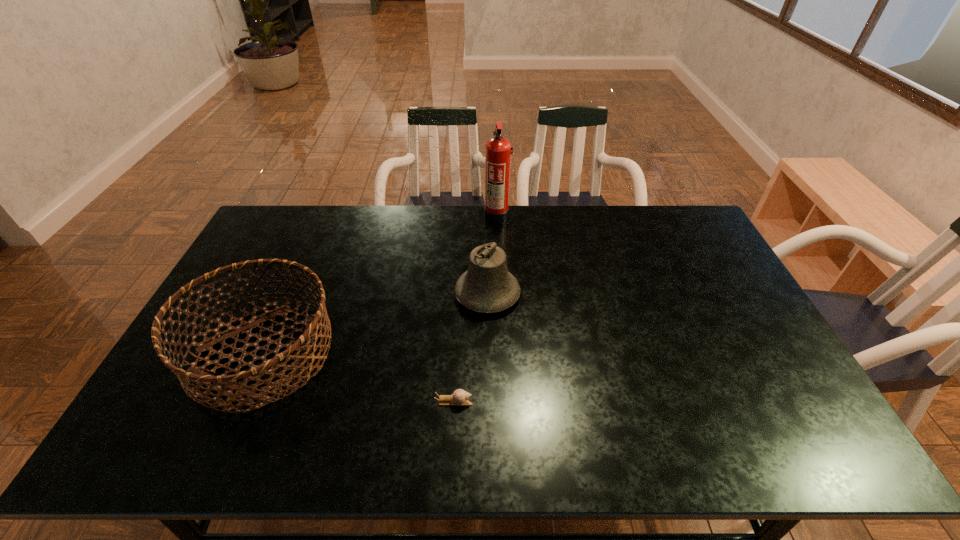
I want to click on fire extinguisher, so click(498, 152).

Image resolution: width=960 pixels, height=540 pixels. What are the coordinates of `the tallest object` in the screenshot? It's located at (498, 152).

You are a GUI agent. You are given a task and a screenshot of the screen. Output one action in this format:
    pyautogui.click(x=<x>, y=<y>)
    Task: Click on the bell
    The height and width of the screenshot is (540, 960).
    Given the screenshot: What is the action you would take?
    pyautogui.click(x=487, y=286)

The height and width of the screenshot is (540, 960). Find the location of `basket`. basket is located at coordinates (303, 344).

This screenshot has height=540, width=960. I want to click on escargot, so click(x=459, y=397).

Where is `vacant space positioned 0.130m with the nozzle pointing from the back of the farthest object`? The height and width of the screenshot is (540, 960). vacant space positioned 0.130m with the nozzle pointing from the back of the farthest object is located at coordinates (450, 215).

Find the location of `vacant space located 0.170m with the nozzle pointing from the back of the farthest object`. vacant space located 0.170m with the nozzle pointing from the back of the farthest object is located at coordinates (440, 215).

You are a GUI agent. You are given a task and a screenshot of the screen. Output one action in this format:
    pyautogui.click(x=<x>, y=<y>)
    Task: Click on the vacant space located 0.100m with the nozzle pointing from the back of the farthest object
    This screenshot has width=960, height=540.
    Given the screenshot: What is the action you would take?
    pos(458,215)

This screenshot has width=960, height=540. I want to click on blank space located 0.190m on the front of the bell, so click(489, 373).

At what (x,y) coordinates should I click in order to perform the action: click on vacant area situated 0.090m on the right of the leftmost object. Please return your answer as a coordinate pair (x, y). The width and height of the screenshot is (960, 540). Looking at the image, I should click on (368, 353).